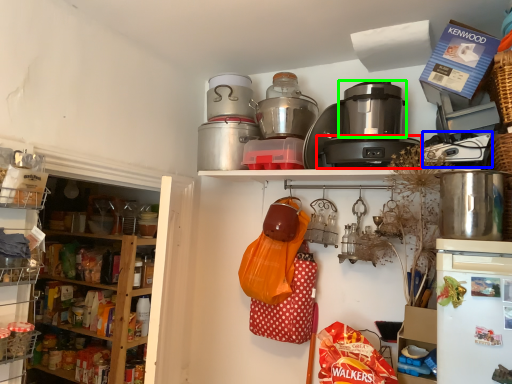
Question: Based on their relative distances, which object is nearer to appliance (highlighted by a red box)? Choose from appliance (highlighted by a blue box) and rice cooker (highlighted by a green box).

Choices:
 (A) appliance
 (B) rice cooker

Answer: (B)